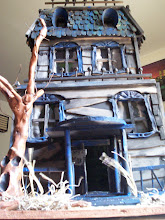
Locate an element on the screen. The width and height of the screenshot is (165, 220). picture frame is located at coordinates (3, 122).